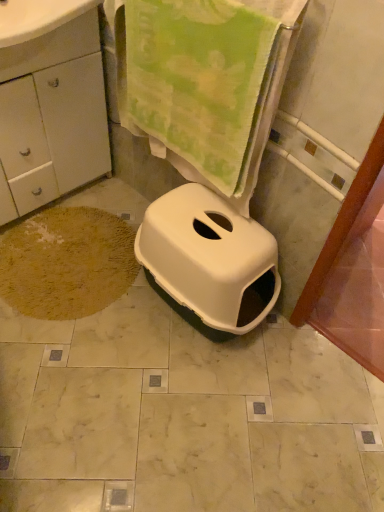
Locate an element on the screen. free space to the left of white plastic litter box at center is located at coordinates (90, 335).